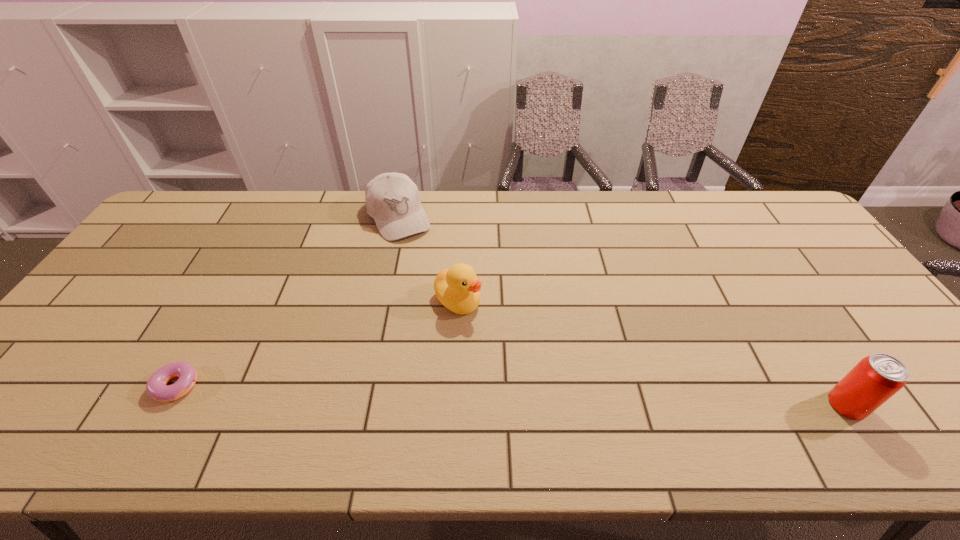
You are a GUI agent. You are given a task and a screenshot of the screen. Output one action in this format:
    pyautogui.click(x=<x>, y=<y>)
    Task: Click on the vacant space on the desktop that is between the leftmost object and the can and is positioned at the beak of the duck
    This screenshot has height=540, width=960.
    Given the screenshot: What is the action you would take?
    pyautogui.click(x=564, y=395)

The width and height of the screenshot is (960, 540). In order to click on free space on the desktop that is between the leftmost object and the rightmost object and is positioned on the front-facing side of the second object from left to right in this screenshot , I will do pos(501,392).